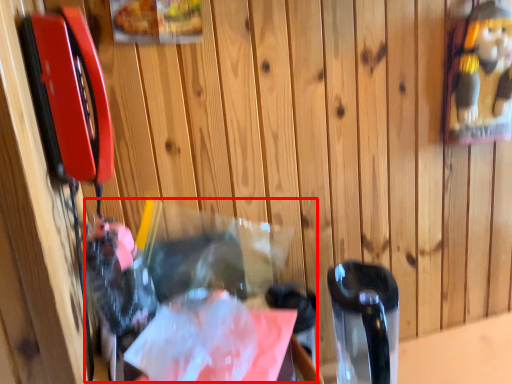
Question: From the image's perspective, where is waste (annotated by the red box) located relative to wrapping paper?

Choices:
 (A) below
 (B) above

Answer: (A)